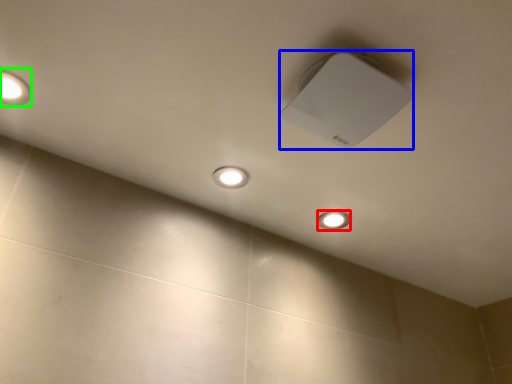
Question: Which object is positioned closest to dot (highlighted by a red box)? Select from lamp (highlighted by a blue box) and lamp (highlighted by a green box).

Choices:
 (A) lamp
 (B) lamp

Answer: (A)